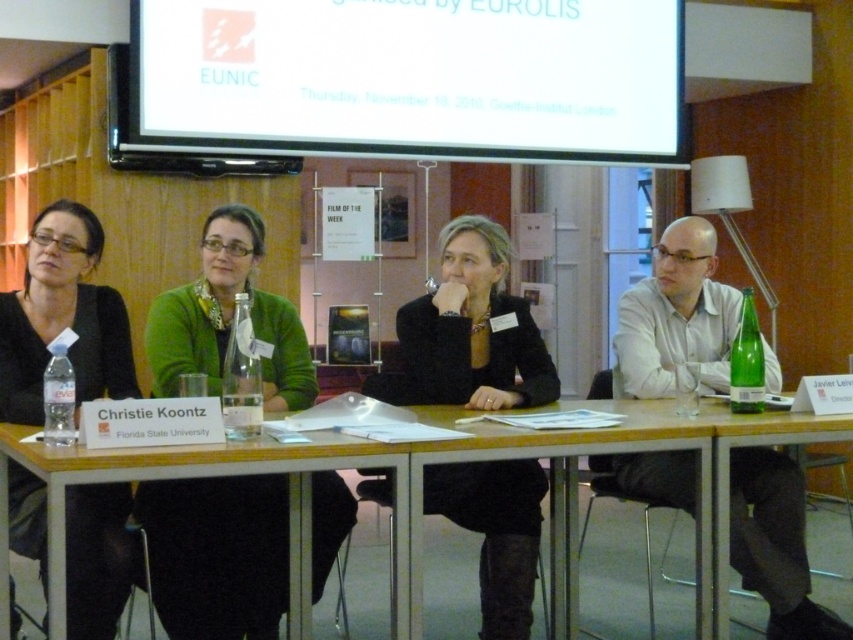
You are attending a panel discussion and need to present a slide. The screen is the white glossy projection screen at upper center and the table is the wooden table at center. Where should you position yourself to present your slides effectively?

You should position yourself to the side of the wooden table at center, facing the white glossy projection screen at upper center, as the screen is above the table and likely positioned for presenters to stand beside the table while addressing the audience.

You are attending a panel discussion and notice the white glossy projection screen at upper center and the green sweater at center. Which object is located to the right of the other?

The white glossy projection screen at upper center is positioned on the right side of green sweater at center.

You are a photographer setting up for a panel discussion. You notice the matte black jacket at left and the clear glass bottle at center. Which object is closer to the front of the scene?

The matte black jacket at left is closer to the front of the scene because it is in front of the clear glass bottle at center.